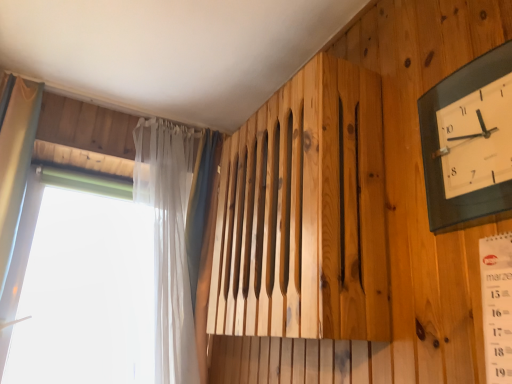
Question: From the image's perspective, does translucent fabric curtain at left appear higher than transparent plastic window at left?

Choices:
 (A) yes
 (B) no

Answer: (A)

Question: From the image's perspective, is translucent fabric curtain at left below transparent plastic window at left?

Choices:
 (A) no
 (B) yes

Answer: (A)

Question: Is there a large distance between translucent fabric curtain at left and transparent plastic window at left?

Choices:
 (A) no
 (B) yes

Answer: (A)

Question: Can you confirm if translucent fabric curtain at left is positioned to the right of transparent plastic window at left?

Choices:
 (A) yes
 (B) no

Answer: (B)

Question: Could you tell me if translucent fabric curtain at left is facing transparent plastic window at left?

Choices:
 (A) no
 (B) yes

Answer: (A)

Question: Considering the positions of transparent plastic window at left and translucent fabric curtain at left in the image, is transparent plastic window at left wider or thinner than translucent fabric curtain at left?

Choices:
 (A) thin
 (B) wide

Answer: (A)

Question: Based on their positions, is transparent plastic window at left located to the left or right of translucent fabric curtain at left?

Choices:
 (A) right
 (B) left

Answer: (A)

Question: From a real-world perspective, is transparent plastic window at left positioned above or below translucent fabric curtain at left?

Choices:
 (A) above
 (B) below

Answer: (B)

Question: Is transparent plastic window at left in front of or behind translucent fabric curtain at left in the image?

Choices:
 (A) behind
 (B) front

Answer: (A)

Question: Is transparent plastic window at left to the left or to the right of black glass wall clock at upper right in the image?

Choices:
 (A) right
 (B) left

Answer: (B)

Question: Do you think transparent plastic window at left is within black glass wall clock at upper right, or outside of it?

Choices:
 (A) outside
 (B) inside

Answer: (A)

Question: Is transparent plastic window at left wider or thinner than black glass wall clock at upper right?

Choices:
 (A) thin
 (B) wide

Answer: (B)

Question: From the image's perspective, is transparent plastic window at left located above or below black glass wall clock at upper right?

Choices:
 (A) below
 (B) above

Answer: (A)

Question: In the image, is translucent fabric curtain at left positioned in front of or behind transparent plastic window at left?

Choices:
 (A) front
 (B) behind

Answer: (A)

Question: Considering the positions of point tap(7, 198) and point tap(165, 288), is point tap(7, 198) closer or farther from the camera than point tap(165, 288)?

Choices:
 (A) closer
 (B) farther

Answer: (A)